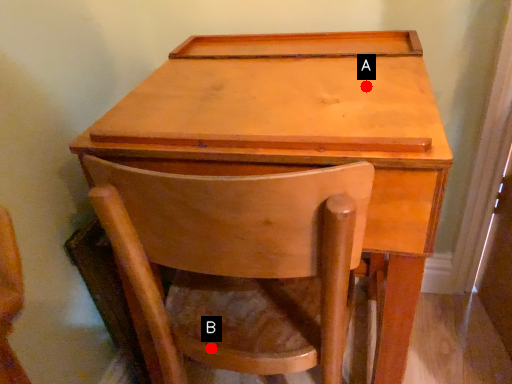
Question: Two points are circled on the image, labeled by A and B beside each circle. Which point is farther from the camera taking this photo?

Choices:
 (A) A is further
 (B) B is further

Answer: (B)